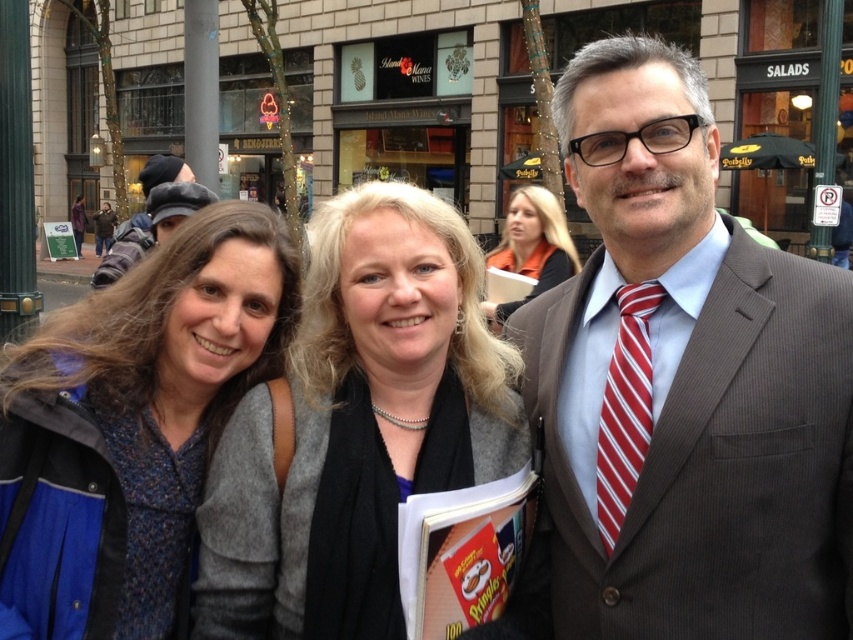
Question: Does blue textured jacket at left have a smaller size compared to red striped tie at right?

Choices:
 (A) yes
 (B) no

Answer: (B)

Question: Which point is closer to the camera?

Choices:
 (A) (576, 166)
 (B) (601, 449)

Answer: (B)

Question: Based on their relative distances, which object is nearer to the blue textured jacket at left?

Choices:
 (A) smooth gray sweater at center
 (B) red striped tie at right

Answer: (A)

Question: Is the position of blonde hair at upper center more distant than that of dark gray knit hat at upper left?

Choices:
 (A) yes
 (B) no

Answer: (A)

Question: Where is brown pinstripe suit at center located in relation to blue textured jacket at left in the image?

Choices:
 (A) left
 (B) right

Answer: (B)

Question: Among these points, which one is farthest from the camera?

Choices:
 (A) (161, 234)
 (B) (200, 353)

Answer: (A)